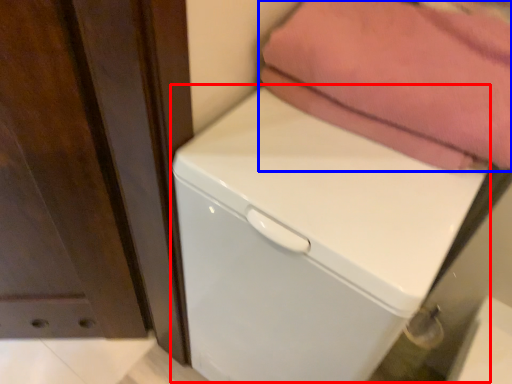
Question: Which of the following is the closest to the observer, dish washer (highlighted by a red box) or towel (highlighted by a blue box)?

Choices:
 (A) dish washer
 (B) towel

Answer: (A)